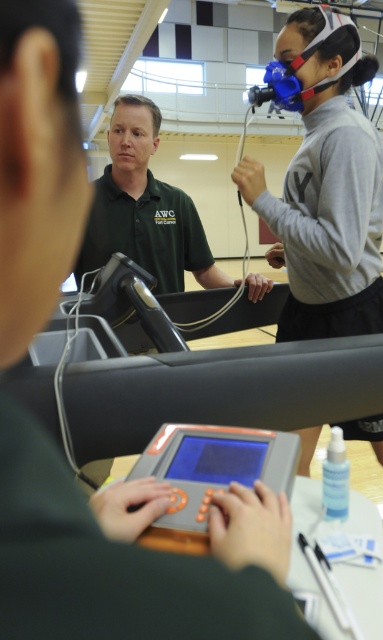
Does point (361, 220) come in front of point (96, 216)?

That is True.

Consider the image. Can you confirm if blue rubber mask at upper center is smaller than green matte shirt at center?

Yes.

Is point (268, 198) behind point (211, 264)?

No, it is in front of (211, 264).

Find the location of a particular element. The image size is (383, 640). blue rubber mask at upper center is located at coordinates (325, 192).

Who is lower down, blue rubber mask at upper center or gray plastic tablet at center?

Positioned lower is gray plastic tablet at center.

Identify the location of blue rubber mask at upper center. (325, 192).

Which is in front, point (379, 218) or point (265, 435)?

Point (265, 435) is more forward.

The image size is (383, 640). In order to click on blue rubber mask at upper center in this screenshot , I will do `click(325, 192)`.

Image resolution: width=383 pixels, height=640 pixels. I want to click on green matte shirt at center, so click(x=145, y=209).

Does point (147, 124) come farther from viewer compared to point (193, 464)?

Yes.

Locate an element on the screen. This screenshot has width=383, height=640. green matte shirt at center is located at coordinates (145, 209).